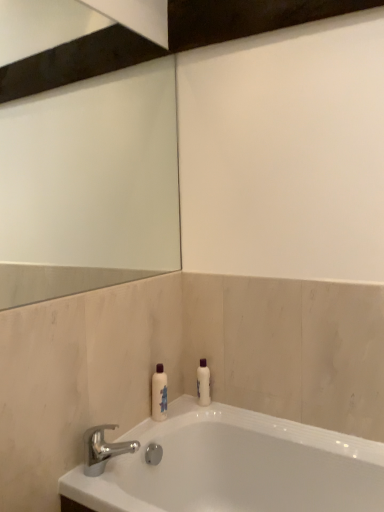
Question: Considering the relative sizes of white glossy bottle at center and white glossy bathtub at lower center in the image provided, is white glossy bottle at center shorter than white glossy bathtub at lower center?

Choices:
 (A) no
 (B) yes

Answer: (B)

Question: Can you confirm if white glossy bottle at center is thinner than white glossy bathtub at lower center?

Choices:
 (A) no
 (B) yes

Answer: (B)

Question: Is white glossy bottle at center smaller than white glossy bathtub at lower center?

Choices:
 (A) yes
 (B) no

Answer: (A)

Question: From a real-world perspective, is white glossy bottle at center on top of white glossy bathtub at lower center?

Choices:
 (A) no
 (B) yes

Answer: (B)

Question: Is white glossy bottle at center further to the viewer compared to white glossy bathtub at lower center?

Choices:
 (A) yes
 (B) no

Answer: (A)

Question: In terms of width, does silver metallic faucet at lower left look wider or thinner when compared to white glossy bottle at center?

Choices:
 (A) wide
 (B) thin

Answer: (A)

Question: Considering the positions of silver metallic faucet at lower left and white glossy bottle at center in the image, is silver metallic faucet at lower left taller or shorter than white glossy bottle at center?

Choices:
 (A) short
 (B) tall

Answer: (A)

Question: Based on their positions, is silver metallic faucet at lower left located to the left or right of white glossy bottle at center?

Choices:
 (A) right
 (B) left

Answer: (B)

Question: From a real-world perspective, is silver metallic faucet at lower left physically located above or below white glossy bottle at center?

Choices:
 (A) above
 (B) below

Answer: (B)

Question: From their relative heights in the image, would you say silver metallic faucet at lower left is taller or shorter than white glossy bathtub at lower center?

Choices:
 (A) tall
 (B) short

Answer: (B)

Question: In the image, is silver metallic faucet at lower left positioned in front of or behind white glossy bathtub at lower center?

Choices:
 (A) front
 (B) behind

Answer: (B)

Question: From a real-world perspective, is silver metallic faucet at lower left physically located above or below white glossy bathtub at lower center?

Choices:
 (A) below
 (B) above

Answer: (B)

Question: In the image, is silver metallic faucet at lower left on the left side or the right side of white glossy bathtub at lower center?

Choices:
 (A) right
 (B) left

Answer: (B)

Question: Looking at the image, does white glossy bottle at center seem bigger or smaller compared to white glossy bathtub at lower center?

Choices:
 (A) big
 (B) small

Answer: (B)

Question: From the image's perspective, is white glossy bottle at center located above or below white glossy bathtub at lower center?

Choices:
 (A) above
 (B) below

Answer: (A)